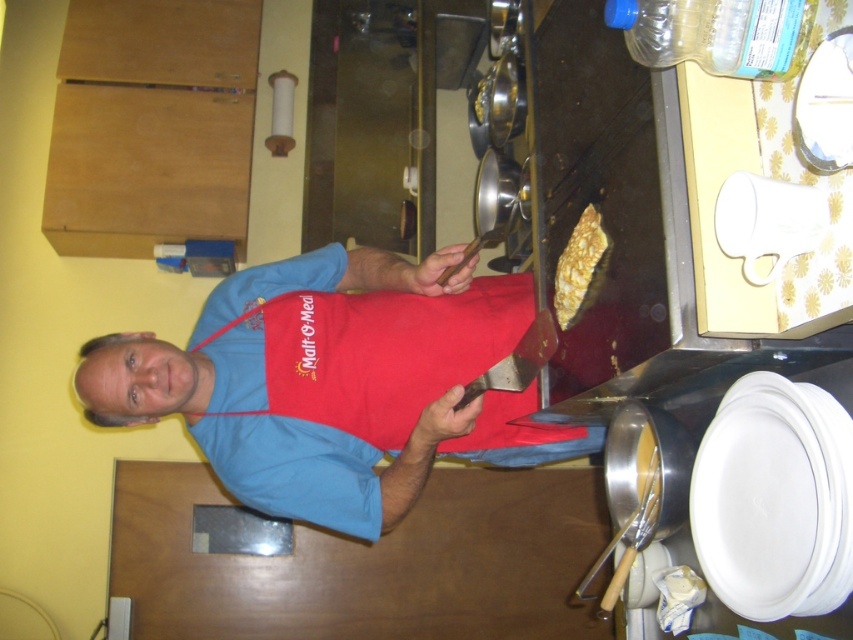
From the picture: You are a chef in the kitchen and need to reach for the golden crispy pancake at upper right while avoiding the blue fabric apron at center. Which direction should you move to get closer to the pancake without hitting the apron?

The blue fabric apron at center is to the left of the golden crispy pancake at upper right, so moving to the right would allow you to approach the pancake while avoiding the apron.

You are a chef in the kitchen. You need to retrieve the golden crispy pancake at upper right but there is the blue fabric apron at center in your way. Can you reach the pancake without moving the apron?

The golden crispy pancake at upper right is behind the blue fabric apron at center, so you can reach it without moving the apron since it is positioned behind.